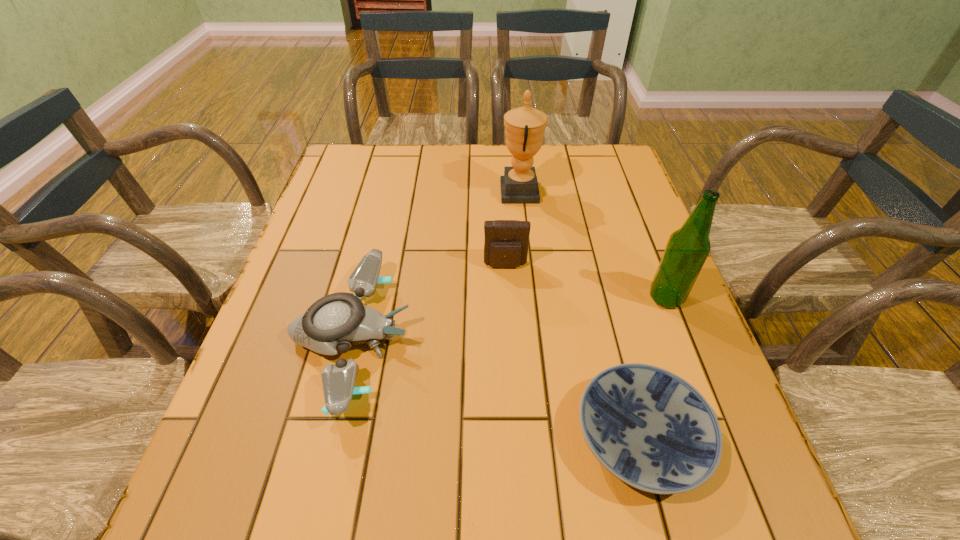
Find the location of a particular element. This screenshot has height=540, width=960. vacant region that satisfies the following two spatial constraints: 1. at the front of the award with handles; 2. with an open flap on the pouch is located at coordinates (528, 265).

I want to click on free space in the image that satisfies the following two spatial constraints: 1. with an open flap on the third tallest object; 2. on the left side of the plate, so click(x=516, y=436).